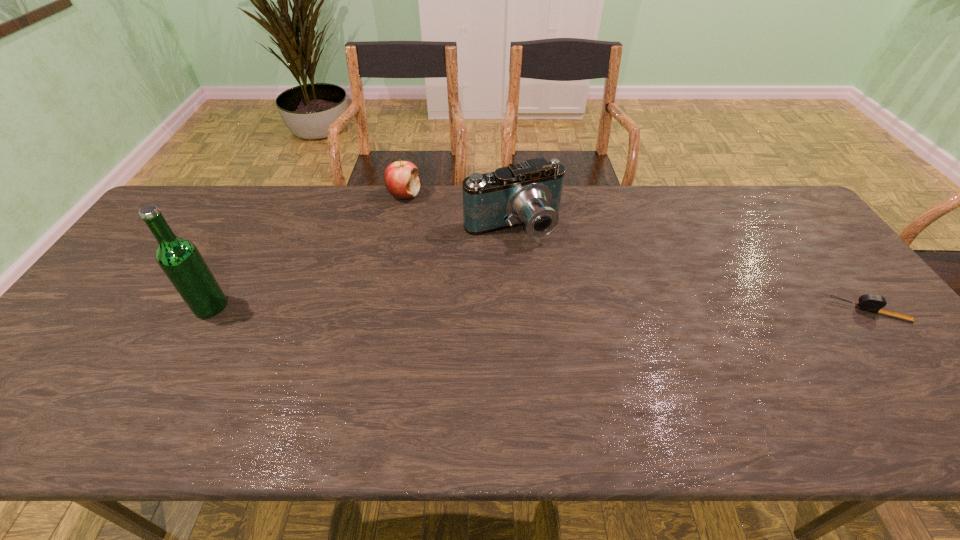
Identify the location of free region located on the front-facing side of the third shortest object. This screenshot has width=960, height=540. (567, 306).

Identify the location of vacant area situated 0.290m on the front-facing side of the third shortest object. This screenshot has height=540, width=960. (576, 320).

Identify the location of vacant space located 0.060m on the front-facing side of the third shortest object. (539, 261).

At what (x,y) coordinates should I click in order to perform the action: click on vacant region located 0.160m on the bitten side of the third object from right to left. Please return your answer as a coordinate pair (x, y). Image resolution: width=960 pixels, height=540 pixels. Looking at the image, I should click on (429, 232).

The width and height of the screenshot is (960, 540). Find the location of `free region located on the bitten side of the third object from right to left`. free region located on the bitten side of the third object from right to left is located at coordinates (418, 215).

Where is `vacant region located 0.350m on the bitten side of the third object from right to left`? The width and height of the screenshot is (960, 540). vacant region located 0.350m on the bitten side of the third object from right to left is located at coordinates (455, 270).

Locate an element on the screen. The width and height of the screenshot is (960, 540). camcorder at the far edge is located at coordinates (529, 193).

Locate an element on the screen. apple situated at the far edge is located at coordinates (401, 179).

Identify the location of object present at the right edge. (873, 303).

You are a GUI agent. You are given a task and a screenshot of the screen. Output one action in this format:
    pyautogui.click(x=<x>, y=<y>)
    Task: Click on the vacant region at the far edge of the desktop
    Image resolution: width=960 pixels, height=540 pixels.
    Given the screenshot: What is the action you would take?
    pyautogui.click(x=581, y=219)